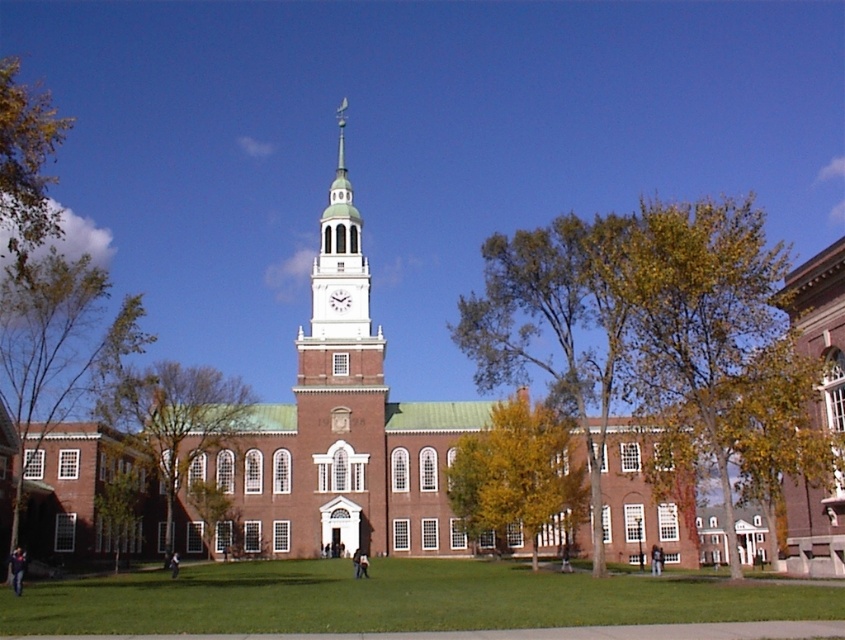
Find the location of a particular element. This screenshot has width=845, height=640. yellow leafy tree at center is located at coordinates (515, 474).

Is point (570, 483) closer to viewer compared to point (326, 333)?

Yes, it is.

Find the location of a particular element. The width and height of the screenshot is (845, 640). yellow leafy tree at center is located at coordinates (515, 474).

Can you confirm if yellow-green leaves at center is wider than green leafy tree at lower left?

Indeed, yellow-green leaves at center has a greater width compared to green leafy tree at lower left.

Who is more forward, (559, 252) or (105, 500)?

Point (105, 500)

Where is `yellow-green leaves at center`? yellow-green leaves at center is located at coordinates (555, 324).

Image resolution: width=845 pixels, height=640 pixels. What are the coordinates of `yellow-green leaves at center` in the screenshot? It's located at (555, 324).

Which is more to the right, white painted wood clock tower at center or white glossy clock at center?

white glossy clock at center

Can you confirm if white painted wood clock tower at center is positioned below white glossy clock at center?

Incorrect, white painted wood clock tower at center is not positioned below white glossy clock at center.

What do you see at coordinates (341, 288) in the screenshot? I see `white painted wood clock tower at center` at bounding box center [341, 288].

This screenshot has width=845, height=640. What are the coordinates of `white painted wood clock tower at center` in the screenshot? It's located at (341, 288).